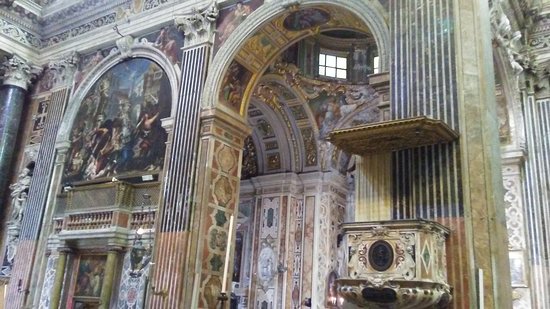
At what (x,y) coordinates should I click in order to perform the action: click on pillar. Please return your answer as a coordinate pair (x, y). The image size is (550, 309). Looking at the image, I should click on (181, 229).